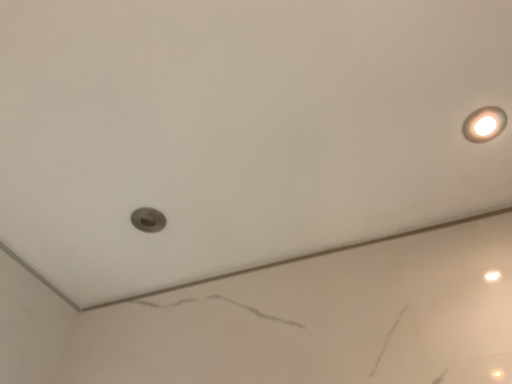
The width and height of the screenshot is (512, 384). Describe the element at coordinates (484, 124) in the screenshot. I see `matte white light fixture at upper right` at that location.

Where is `matte white light fixture at upper right`? matte white light fixture at upper right is located at coordinates (484, 124).

In order to click on matte gray hole at center-left in this screenshot , I will do `click(148, 220)`.

What do you see at coordinates (148, 220) in the screenshot?
I see `matte gray hole at center-left` at bounding box center [148, 220].

In order to click on matte white light fixture at upper right in this screenshot , I will do `click(484, 124)`.

Which is more to the left, matte white light fixture at upper right or matte gray hole at center-left?

matte gray hole at center-left.

Is matte white light fixture at upper right positioned before matte gray hole at center-left?

That is True.

Which is closer, (494, 106) or (151, 211)?

Point (494, 106) is positioned closer to the camera compared to point (151, 211).

From the image's perspective, is matte white light fixture at upper right positioned above or below matte gray hole at center-left?

matte white light fixture at upper right is above matte gray hole at center-left.

From a real-world perspective, is matte white light fixture at upper right above or below matte gray hole at center-left?

Clearly, from a real-world perspective, matte white light fixture at upper right is below matte gray hole at center-left.

Which of these two, matte white light fixture at upper right or matte gray hole at center-left, is wider?

matte white light fixture at upper right.

Who is taller, matte white light fixture at upper right or matte gray hole at center-left?

With more height is matte gray hole at center-left.

Looking at the image, does matte white light fixture at upper right seem bigger or smaller compared to matte gray hole at center-left?

Clearly, matte white light fixture at upper right is smaller in size than matte gray hole at center-left.

Is matte white light fixture at upper right completely or partially outside of matte gray hole at center-left?

Yes, matte white light fixture at upper right is not within matte gray hole at center-left.

Is matte white light fixture at upper right beside matte gray hole at center-left?

No, matte white light fixture at upper right is not in contact with matte gray hole at center-left.

Is matte white light fixture at upper right positioned with its back to matte gray hole at center-left?

No, matte white light fixture at upper right is not facing away from matte gray hole at center-left.

Can you tell me how much matte white light fixture at upper right and matte gray hole at center-left differ in facing direction?

The angle between the facing direction of matte white light fixture at upper right and the facing direction of matte gray hole at center-left is 0.97 degrees.

I want to click on hole located on the left of matte white light fixture at upper right, so click(148, 220).

Considering the positions of objects matte gray hole at center-left and matte white light fixture at upper right in the image provided, who is more to the right, matte gray hole at center-left or matte white light fixture at upper right?

Positioned to the right is matte white light fixture at upper right.

Which object is closer to the camera taking this photo, matte gray hole at center-left or matte white light fixture at upper right?

matte white light fixture at upper right is closer to the camera.

Considering the positions of point (160, 222) and point (506, 121), is point (160, 222) closer or farther from the camera than point (506, 121)?

Point (160, 222) is farther from the camera than point (506, 121).

From the image's perspective, would you say matte gray hole at center-left is positioned over matte white light fixture at upper right?

No.

From a real-world perspective, is matte gray hole at center-left beneath matte white light fixture at upper right?

No, from a real-world perspective, matte gray hole at center-left is not beneath matte white light fixture at upper right.

Does matte gray hole at center-left have a greater width compared to matte white light fixture at upper right?

No.

Which of these two, matte gray hole at center-left or matte white light fixture at upper right, stands shorter?

matte white light fixture at upper right is shorter.

Between matte gray hole at center-left and matte white light fixture at upper right, which one has larger size?

Bigger between the two is matte gray hole at center-left.

Is matte white light fixture at upper right a part of matte gray hole at center-left?

Definitely not — matte white light fixture at upper right is not inside matte gray hole at center-left.

Can you see matte gray hole at center-left touching matte white light fixture at upper right?

No, matte gray hole at center-left is not in contact with matte white light fixture at upper right.

Is matte gray hole at center-left oriented away from matte white light fixture at upper right?

No, matte gray hole at center-left is not facing away from matte white light fixture at upper right.

What's the angular difference between matte gray hole at center-left and matte white light fixture at upper right's facing directions?

0.97 degrees separate the facing orientations of matte gray hole at center-left and matte white light fixture at upper right.

How far apart are matte gray hole at center-left and matte white light fixture at upper right?

matte gray hole at center-left and matte white light fixture at upper right are 30.42 inches apart.

Locate an element on the screen. Image resolution: width=512 pixels, height=384 pixels. light fixture that appears in front of the matte gray hole at center-left is located at coordinates (484, 124).

Identify the location of hole above the matte white light fixture at upper right (from a real-world perspective). (148, 220).

The image size is (512, 384). In the image, there is a matte gray hole at center-left. What are the coordinates of `light fixture below it (from a real-world perspective)` in the screenshot? It's located at (484, 124).